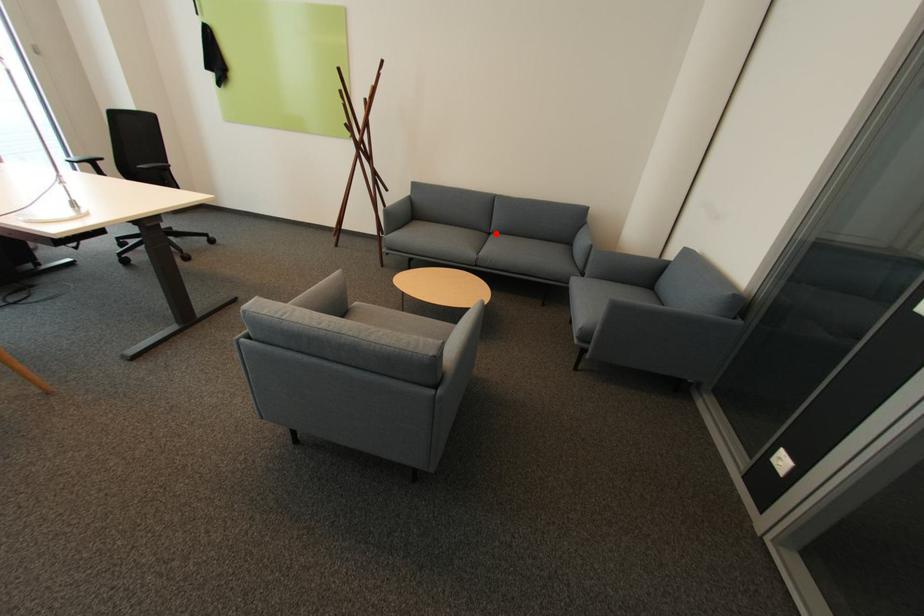
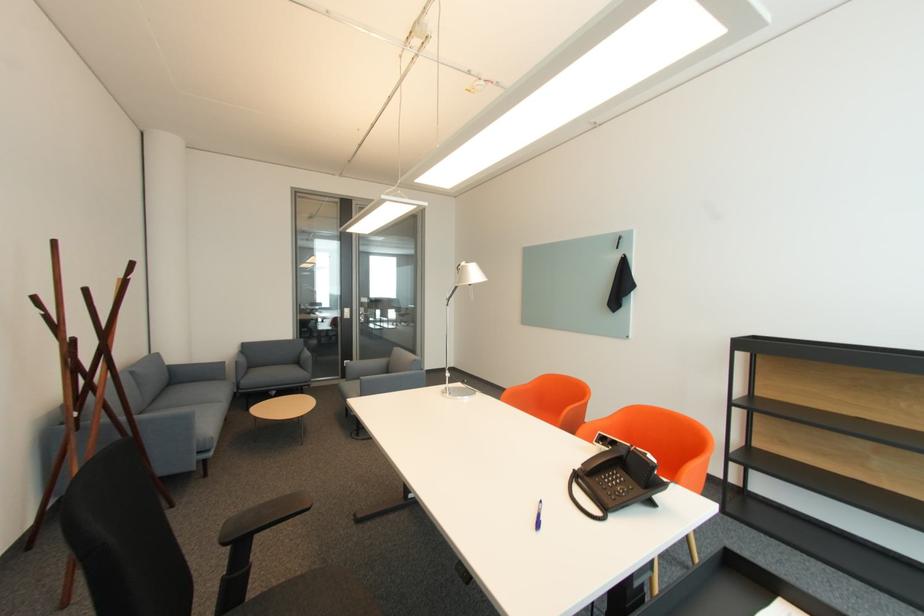
The point at the highlighted location is marked in the first image. Where is the corresponding point in the second image?

(151, 411)